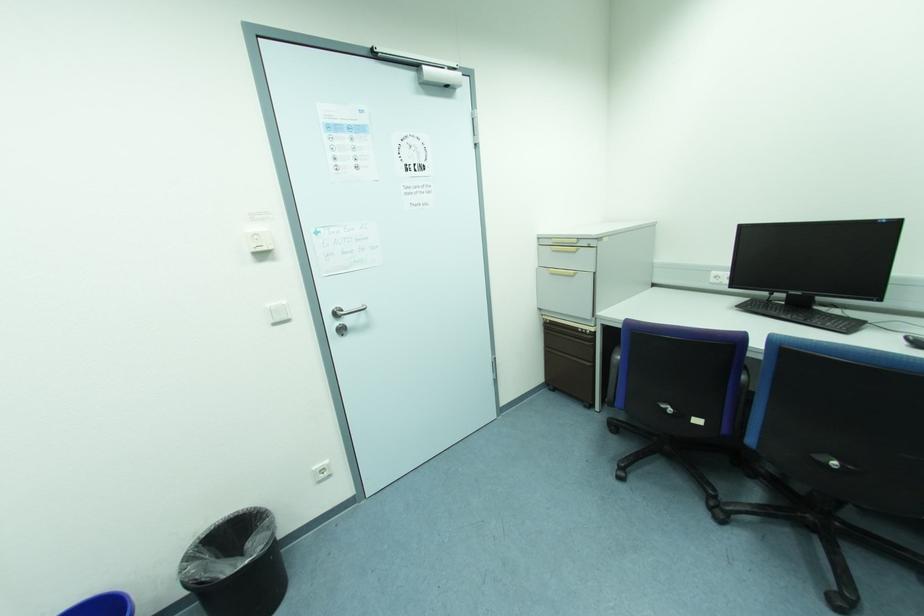
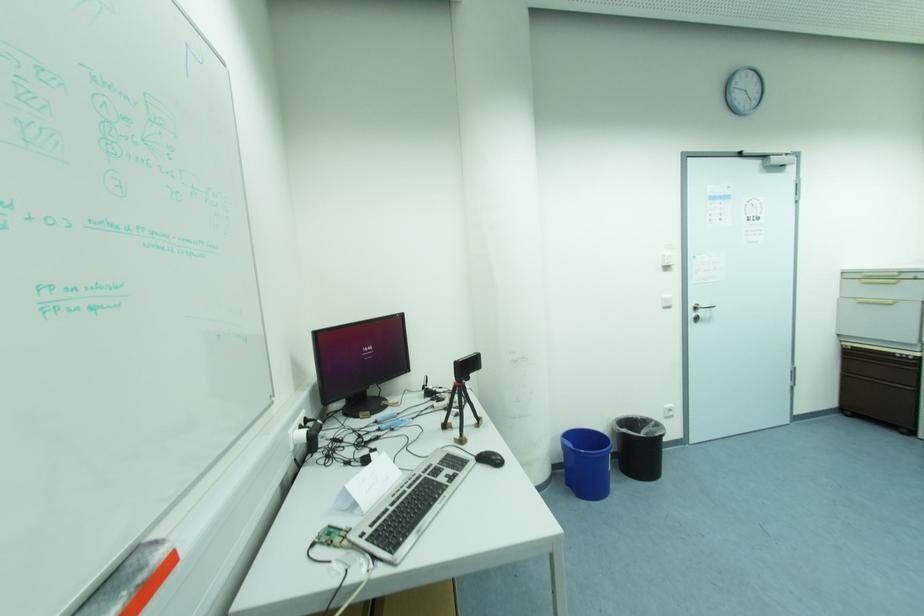
Where in the second image is the point corresponding to (580,331) from the first image?

(898, 355)